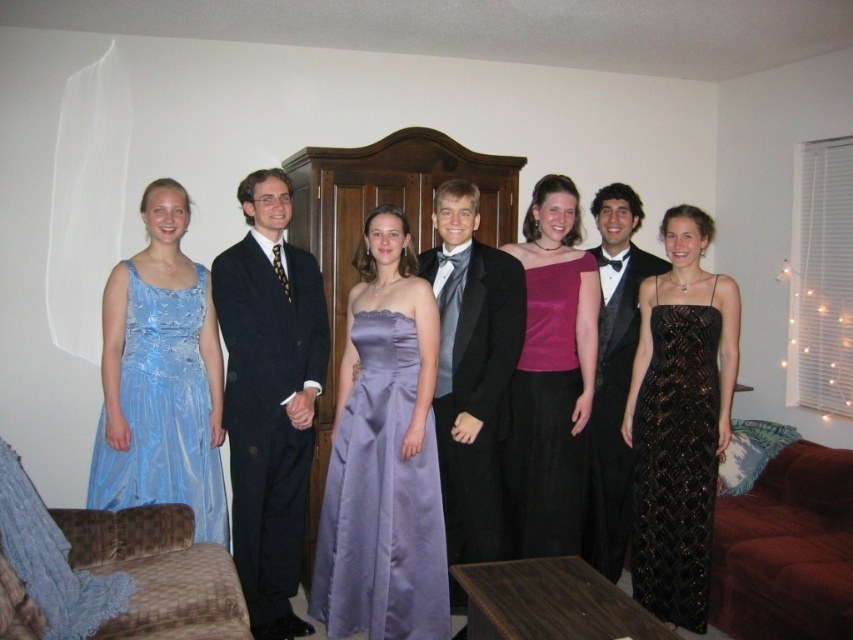
Identify the location of shiny black suit at center. (471, 369).

Can you confirm if shiny black suit at center is thinner than black sequined dress at center?

No, shiny black suit at center is not thinner than black sequined dress at center.

At what (x,y) coordinates should I click in order to perform the action: click on shiny black suit at center. Please return your answer as a coordinate pair (x, y). This screenshot has width=853, height=640. Looking at the image, I should click on (471, 369).

Find the location of a particular element. shiny black suit at center is located at coordinates (471, 369).

Which is more to the left, silky satin dress at center or black satin tuxedo at center?

Positioned to the left is silky satin dress at center.

Which is in front, point (296, 177) or point (613, 365)?

Positioned in front is point (613, 365).

The image size is (853, 640). What are the coordinates of `silky satin dress at center` in the screenshot? It's located at (358, 230).

Who is positioned more to the right, shiny blue dress at left or black satin tuxedo at center?

Positioned to the right is black satin tuxedo at center.

Who is positioned more to the left, shiny blue dress at left or black satin tuxedo at center?

Positioned to the left is shiny blue dress at left.

What do you see at coordinates (161, 412) in the screenshot? The height and width of the screenshot is (640, 853). I see `shiny blue dress at left` at bounding box center [161, 412].

At what (x,y) coordinates should I click in order to perform the action: click on shiny blue dress at left. Please return your answer as a coordinate pair (x, y). Looking at the image, I should click on (161, 412).